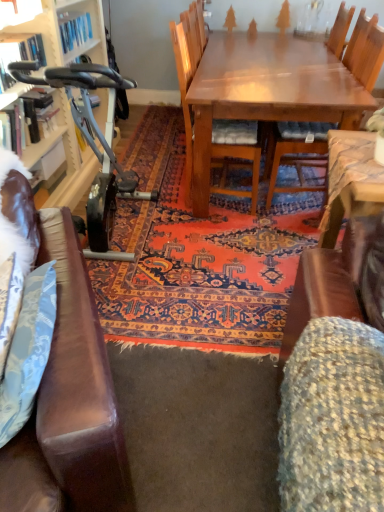
Find the location of a particular element. This screenshot has width=384, height=512. vacant area that is situated to the right of metallic blue exercise bike at left is located at coordinates (205, 248).